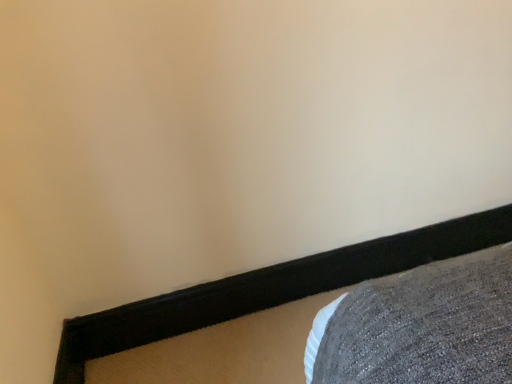
Where is `textured gray fabric at lower right`? This screenshot has width=512, height=384. textured gray fabric at lower right is located at coordinates (268, 288).

Image resolution: width=512 pixels, height=384 pixels. What do you see at coordinates (268, 288) in the screenshot?
I see `textured gray fabric at lower right` at bounding box center [268, 288].

Measure the distance between point (x=82, y=349) and camera.

Point (x=82, y=349) is 1.30 meters away from camera.

What is the approximate width of textured gray fabric at lower right?

1.64 inches.

What are the coordinates of `textured gray fabric at lower right` in the screenshot? It's located at (268, 288).